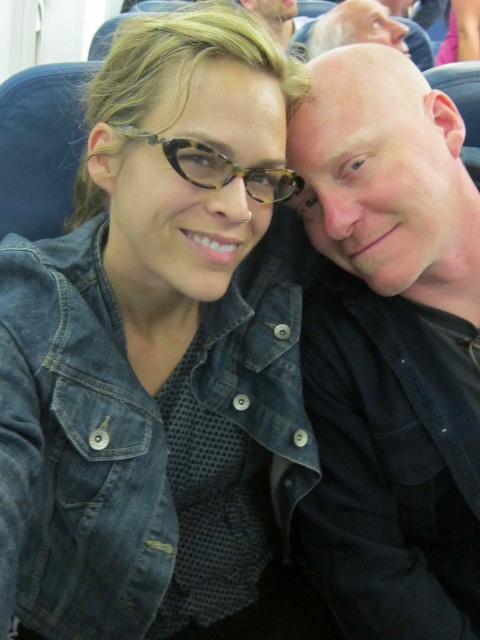
You are sitting in a public transportation seat and see the black matte shirt at right and the tortoiseshell glasses at upper center. Which object is closer to the right side of the seat?

The black matte shirt at right is closer to the right side of the seat because it is positioned to the right of the tortoiseshell glasses at upper center.

You are a photographer trying to capture a closeup of the black matte shirt at right and the tortoiseshell glasses at upper center. Since you want to focus on both objects equally, which one requires you to adjust your camera to a wider angle to accommodate its larger size?

The black matte shirt at right requires a wider angle because its width surpasses that of the tortoiseshell glasses at upper center.

You are a photographer trying to capture a closeup of the tortoiseshell glasses at upper center without including the faded denim jacket at lower right in the frame. Given their sizes, is this possible?

The faded denim jacket at lower right is wider than the tortoiseshell glasses at upper center, so it might be challenging to frame the glasses without including the jacket if they are positioned closely together. However, by zooming in or adjusting the camera angle to focus solely on the smaller tortoiseshell glasses at upper center, it could be achievable.